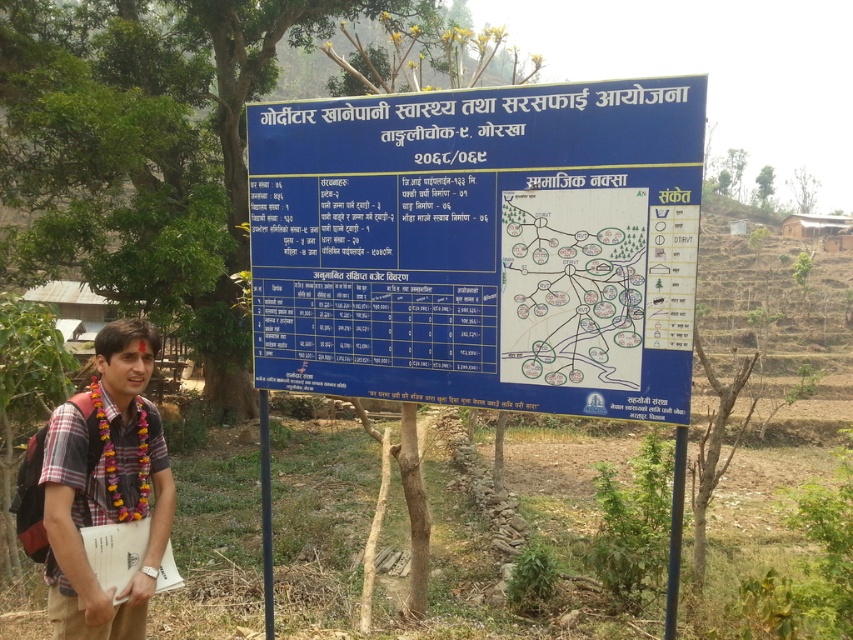
You are a tourist in Nepal and you see the man with a garland around his neck holding papers next to a blue signboard with a white paper map at center. The map has a point at coordinates (572, 282). If you want to find this point on the map, where should you look?

The point at coordinates (572, 282) is located on the white paper map at center. To find it, look for the map in the center of the signboard and then locate the specific point at those coordinates.

Based on the photo, what is the exact location of the white paper map at center on the signboard?

The white paper map at center is located at point coordinates [572,282].